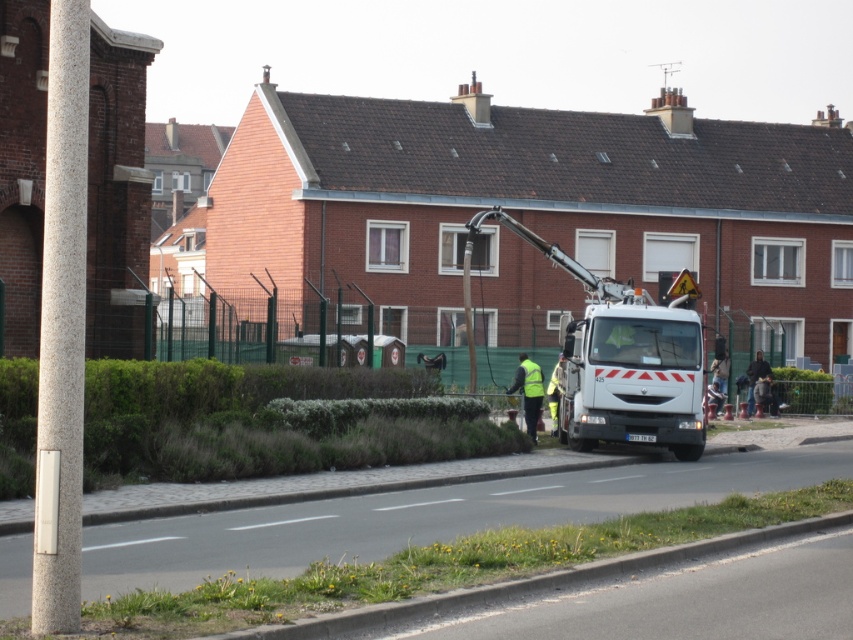
Question: Where is white glossy truck at center located in relation to high visibility yellow vest at center in the image?

Choices:
 (A) right
 (B) left

Answer: (A)

Question: Which object is closer to the camera taking this photo?

Choices:
 (A) high visibility yellow vest at center
 (B) yellow reflective safety vest at center

Answer: (A)

Question: Is white glossy truck at center below yellow reflective safety vest at center?

Choices:
 (A) no
 (B) yes

Answer: (A)

Question: Is high visibility yellow vest at center below yellow reflective safety vest at center?

Choices:
 (A) no
 (B) yes

Answer: (B)

Question: Which point is closer to the camera taking this photo?

Choices:
 (A) (579, 380)
 (B) (514, 384)
 (C) (541, 380)

Answer: (A)

Question: Which object is the farthest from the white glossy truck at center?

Choices:
 (A) yellow reflective safety vest at center
 (B) high visibility yellow vest at center

Answer: (A)